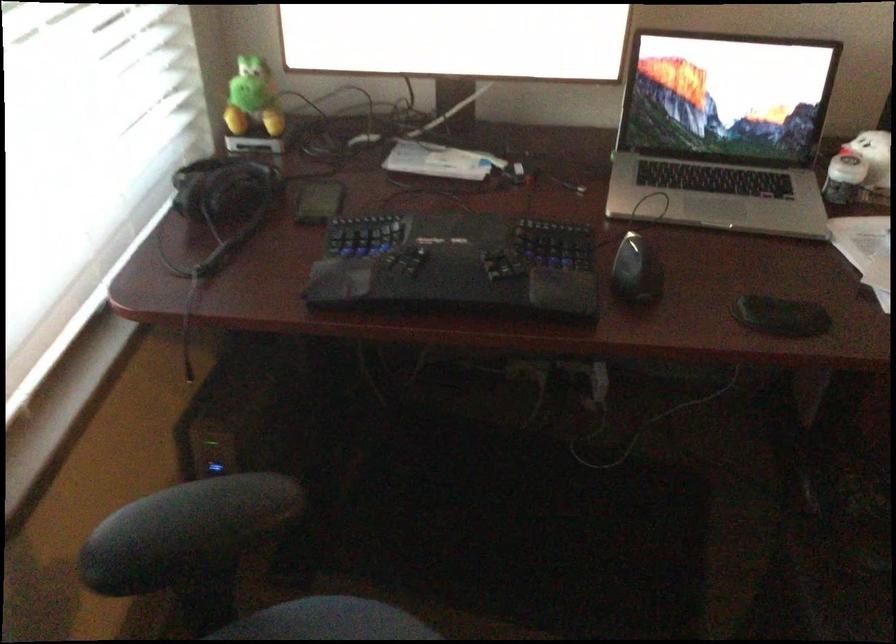
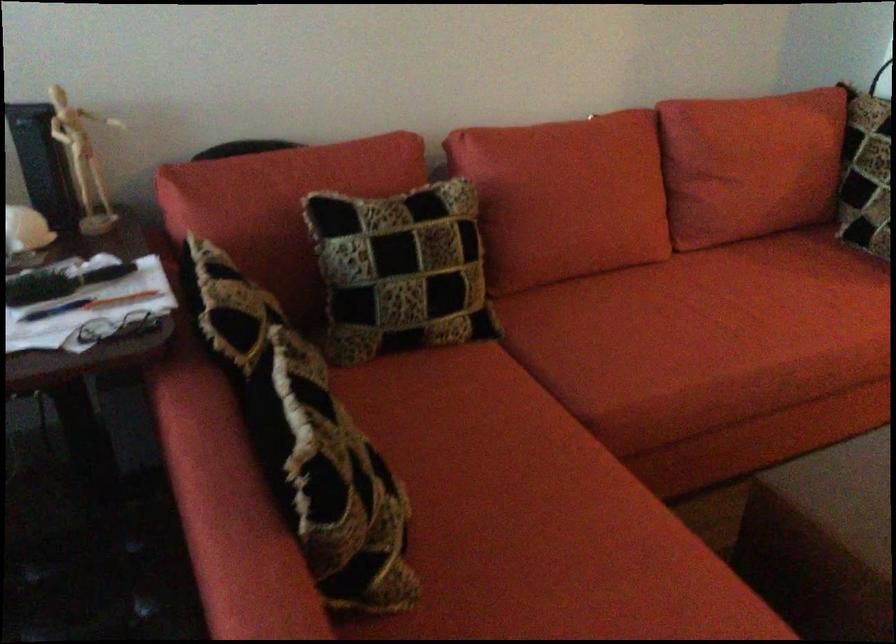
Question: The images are taken continuously from a first-person perspective. In which direction is your viewpoint rotating?

Choices:
 (A) Left
 (B) Right
 (C) Up
 (D) Down

Answer: (B)